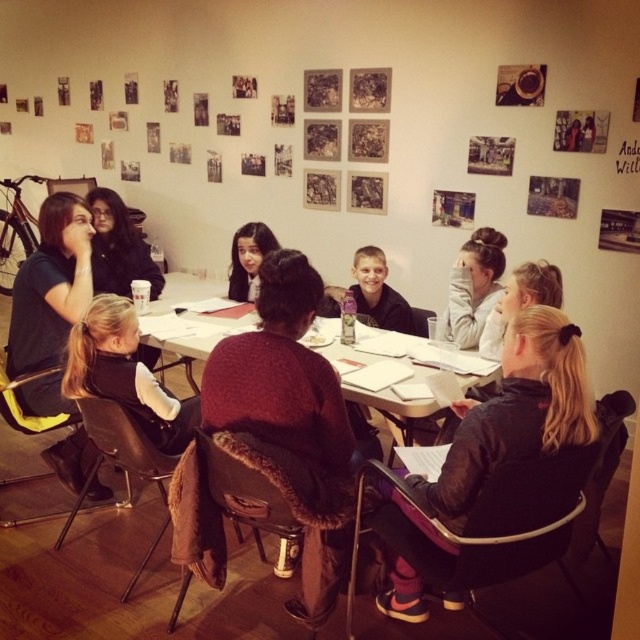
Question: Is white paper at center closer to camera compared to smooth skin boy at center?

Choices:
 (A) yes
 (B) no

Answer: (A)

Question: Which point appears farthest from the camera in this image?

Choices:
 (A) (228, 266)
 (B) (461, 458)

Answer: (A)

Question: Which of the following is the closest to the observer?

Choices:
 (A) (147, 323)
 (B) (252, 280)

Answer: (A)

Question: Is black fleece jacket at lower right further to the viewer compared to matte black hair at center?

Choices:
 (A) yes
 (B) no

Answer: (B)

Question: Among these objects, which one is farthest from the camera?

Choices:
 (A) smooth skin boy at center
 (B) matte black hair at center

Answer: (B)

Question: From the image, what is the correct spatial relationship of black fleece jacket at lower right in relation to white paper at center?

Choices:
 (A) above
 (B) below

Answer: (B)